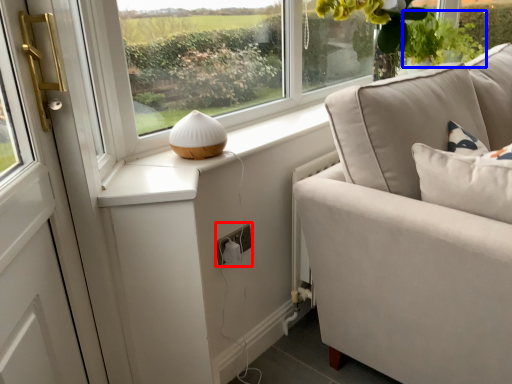
Question: Which object appears farthest to the camera in this image, electric outlet (highlighted by a red box) or plant (highlighted by a blue box)?

Choices:
 (A) electric outlet
 (B) plant

Answer: (B)